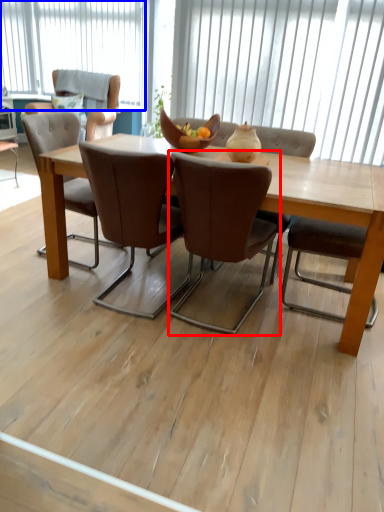
Question: Which object is further to the camera taking this photo, chair (highlighted by a red box) or window (highlighted by a blue box)?

Choices:
 (A) chair
 (B) window

Answer: (B)